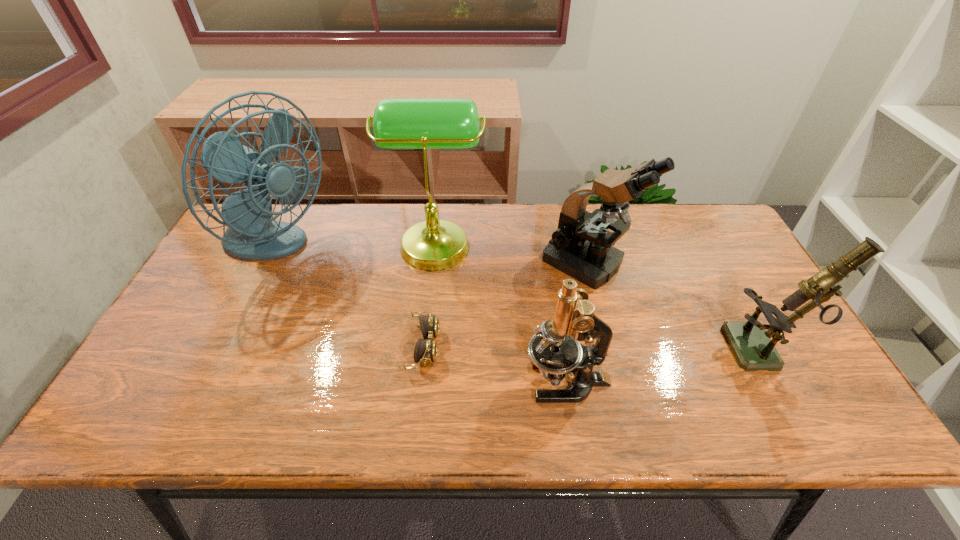
Find the location of `the leftmost object`. the leftmost object is located at coordinates (251, 234).

You are a GUI agent. You are given a task and a screenshot of the screen. Output one action in this format:
    pyautogui.click(x=<x>, y=<y>)
    Task: Click on the lamp
    
    Given the screenshot: What is the action you would take?
    pyautogui.click(x=398, y=123)

This screenshot has width=960, height=540. I want to click on the farthest microscope, so click(x=581, y=247).

Locate an element on the screen. This screenshot has height=540, width=960. the rightmost microscope is located at coordinates (750, 342).

Locate an element on the screen. The height and width of the screenshot is (540, 960). goggles is located at coordinates (426, 350).

Image resolution: width=960 pixels, height=540 pixels. In order to click on free region located in front of the fan to blow air in this screenshot , I will do `click(435, 249)`.

Where is `vacant space located 0.270m on the desk next to the lamp`? Image resolution: width=960 pixels, height=540 pixels. vacant space located 0.270m on the desk next to the lamp is located at coordinates (571, 241).

Where is `vacant area situated on the front of the farthest microscope`? This screenshot has height=540, width=960. vacant area situated on the front of the farthest microscope is located at coordinates (617, 383).

You are a GUI agent. You are given a task and a screenshot of the screen. Output one action in this format:
    pyautogui.click(x=<x>, y=<y>)
    Task: Click on the vacant point located at the eyepiece of the rightmost object
    The image size is (960, 540).
    Given the screenshot: What is the action you would take?
    click(x=578, y=352)

Where is `free space located 0.300m at the eyepiece of the rightmost object`? The width and height of the screenshot is (960, 540). free space located 0.300m at the eyepiece of the rightmost object is located at coordinates (611, 352).